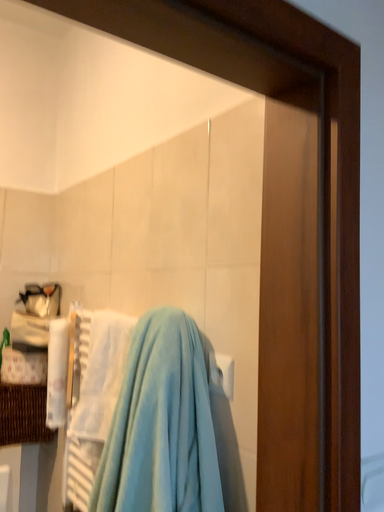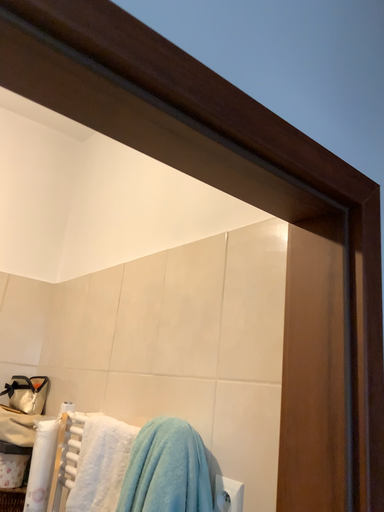
Question: How did the camera likely rotate when shooting the video?

Choices:
 (A) rotated upward
 (B) rotated downward

Answer: (A)